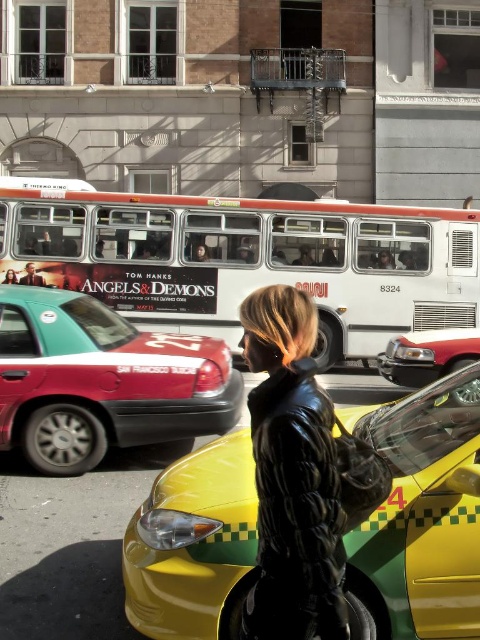
Who is lower down, white matte bus at center or black leather jacket at center?

Positioned lower is black leather jacket at center.

Between white matte bus at center and black leather jacket at center, which one is positioned higher?

white matte bus at center is above.

Who is more forward, (351, 208) or (205, 252)?

Point (205, 252) is in front.

At what (x,y) coordinates should I click in order to perform the action: click on white matte bus at center. Please return your answer as a coordinate pair (x, y). Looking at the image, I should click on (247, 259).

Is white matte bus at center taller than black leather coat at center?

No.

Who is shorter, white matte bus at center or black leather coat at center?

white matte bus at center

Is point (47, 179) positioned in front of point (244, 346)?

No, (47, 179) is behind (244, 346).

Where is `white matte bus at center`? white matte bus at center is located at coordinates (247, 259).

Is point (157, 545) behind point (200, 243)?

No, it is in front of (200, 243).

Does point (432, 556) come behind point (204, 257)?

No.

This screenshot has width=480, height=640. Find the location of `yellow matte taxi at center`. yellow matte taxi at center is located at coordinates (420, 516).